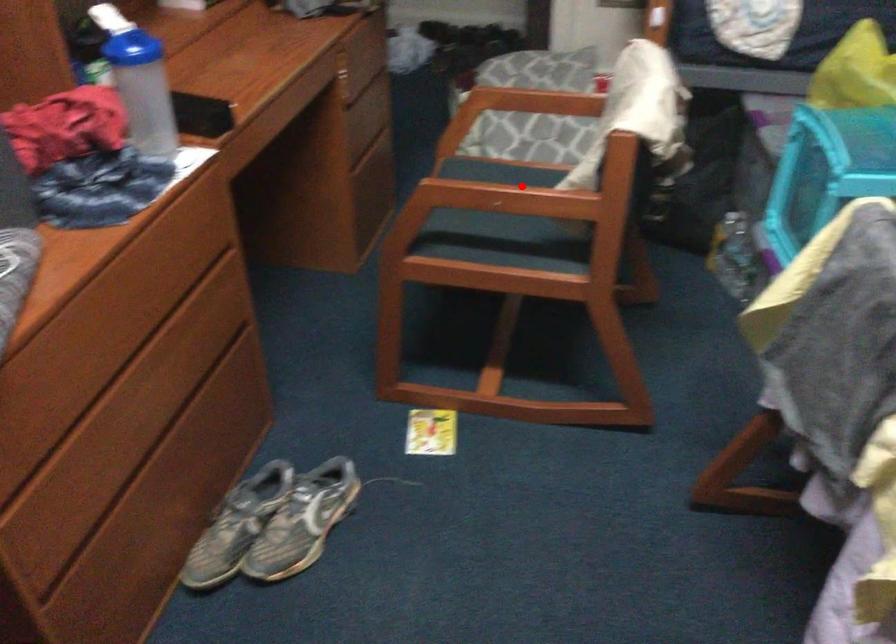
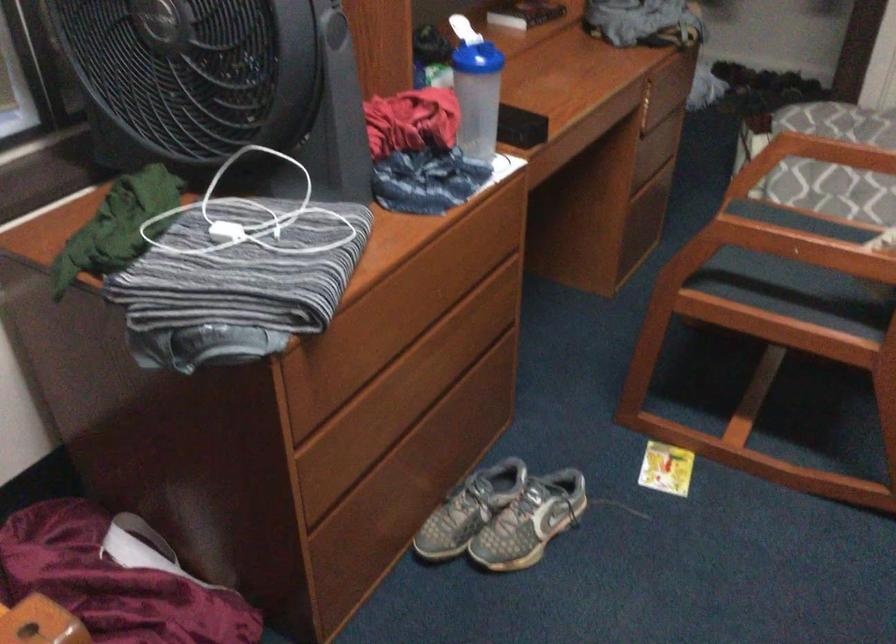
In the second image, find the point that corresponds to the highlighted location in the first image.

(826, 234)